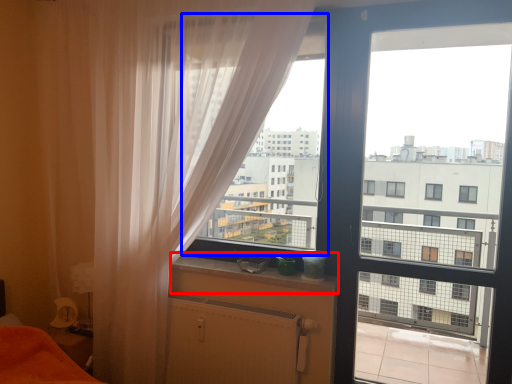
Question: Among these objects, which one is nearest to the camera, window sill (highlighted by a red box) or window screen (highlighted by a blue box)?

Choices:
 (A) window sill
 (B) window screen

Answer: (A)